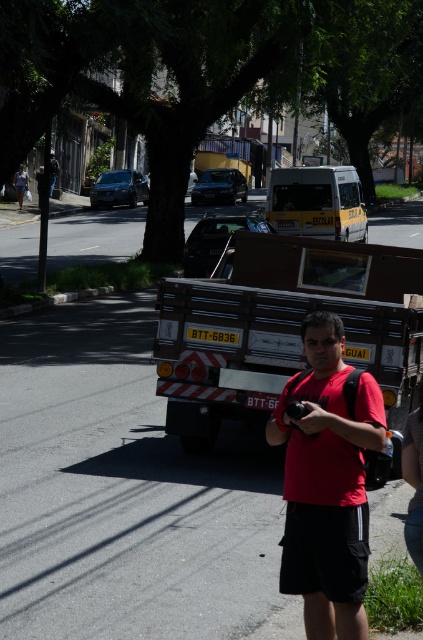
Question: Is metallic silver fire truck at center to the right of yellow matte van at center from the viewer's perspective?

Choices:
 (A) no
 (B) yes

Answer: (A)

Question: Which of the following is the farthest from the observer?

Choices:
 (A) click(420, 513)
 (B) click(343, 214)
 (C) click(332, 563)
 (D) click(187, 333)

Answer: (B)

Question: Does metallic silver fire truck at center appear on the right side of yellow matte van at center?

Choices:
 (A) no
 (B) yes

Answer: (A)

Question: Which point is farther to the camera?

Choices:
 (A) (409, 531)
 (B) (280, 561)
 (C) (288, 168)

Answer: (C)

Question: Does metallic silver fire truck at center come behind yellow matte van at center?

Choices:
 (A) yes
 (B) no

Answer: (B)

Question: Which point is closer to the camera taking this photo?

Choices:
 (A) (296, 225)
 (B) (359, 611)
 (C) (417, 520)

Answer: (C)